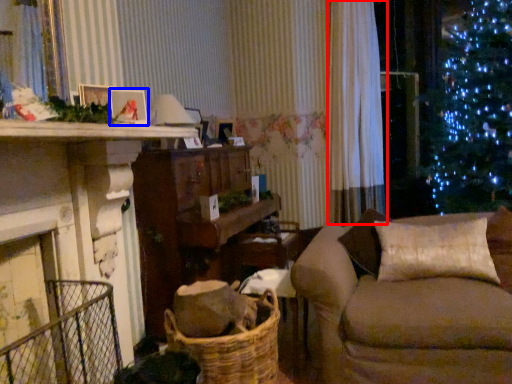
Question: Which of the following is the closest to the observer, curtain (highlighted by a red box) or picture frame (highlighted by a blue box)?

Choices:
 (A) curtain
 (B) picture frame

Answer: (B)